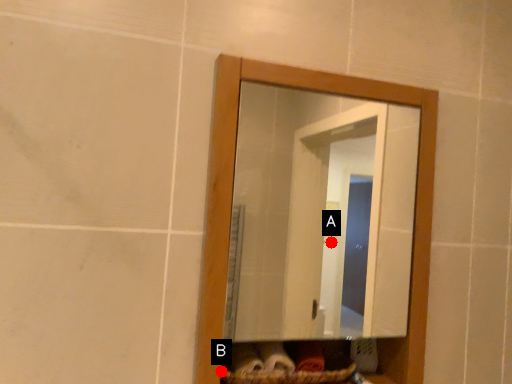
Question: Two points are circled on the image, labeled by A and B beside each circle. Which point is farther to the camera?

Choices:
 (A) A is further
 (B) B is further

Answer: (A)